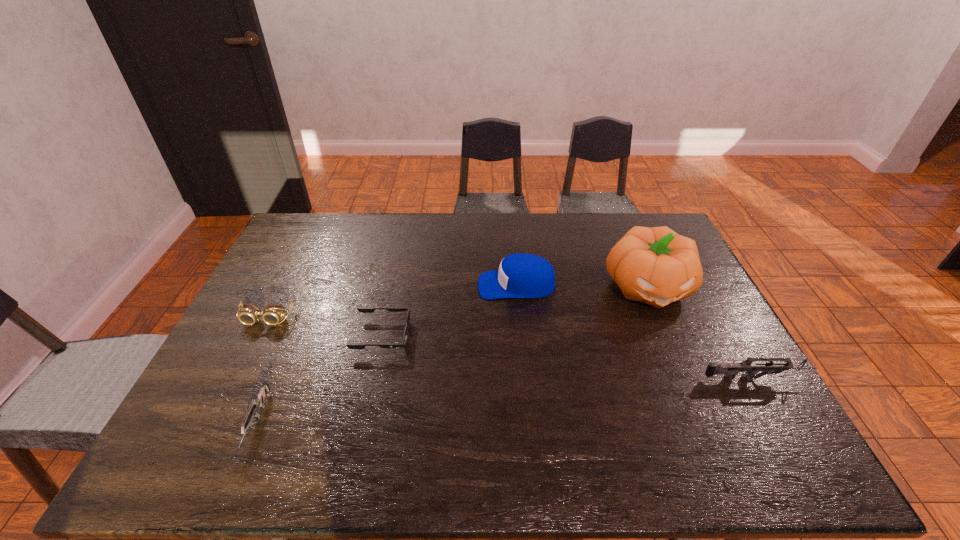
Locate an element on the screen. Image resolution: width=960 pixels, height=540 pixels. free space at the far edge of the desktop is located at coordinates (504, 229).

The width and height of the screenshot is (960, 540). Identify the location of free space at the near edge of the desktop. (324, 397).

Locate an element on the screen. The height and width of the screenshot is (540, 960). free space at the left edge of the desktop is located at coordinates (283, 322).

Locate an element on the screen. The width and height of the screenshot is (960, 540). vacant space at the right edge of the desktop is located at coordinates (729, 334).

This screenshot has height=540, width=960. Find the location of `free region at the far left corner`. free region at the far left corner is located at coordinates (296, 229).

Identify the location of unoccupied position between the tallest object and the fifth object from right to left. This screenshot has width=960, height=540. (452, 355).

Find the location of `empty location between the right gun and the leftmost object`. empty location between the right gun and the leftmost object is located at coordinates (511, 349).

Locate an element on the screen. This screenshot has height=540, width=960. free space between the fourth object from right to left and the goggles is located at coordinates (324, 327).

What are the coordinates of `vacant space that's between the left gun and the shortest object` in the screenshot? It's located at (320, 380).

Image resolution: width=960 pixels, height=540 pixels. Find the location of `free space between the third tallest object and the third object from left to right`. free space between the third tallest object and the third object from left to right is located at coordinates (568, 357).